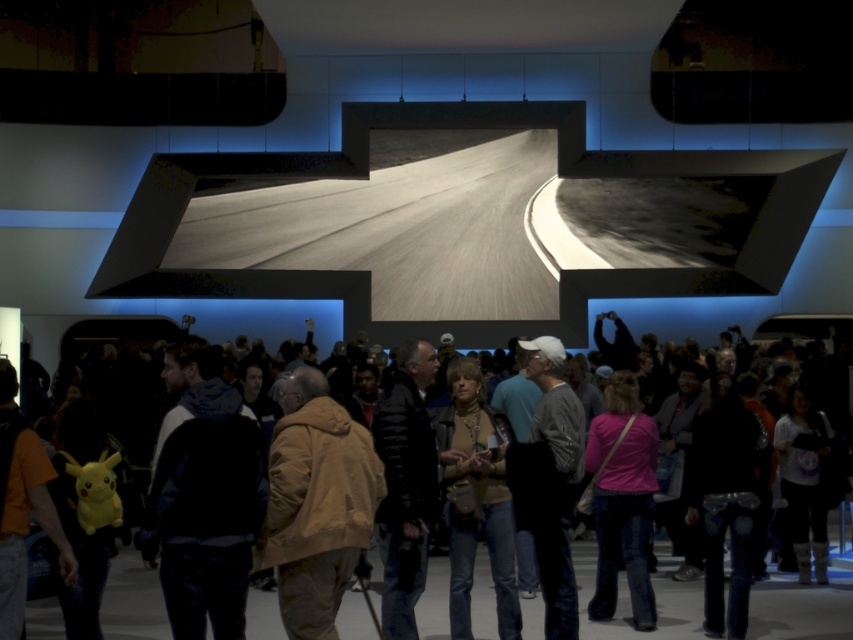
Question: Does dark blue hoodie at center appear on the left side of tan suede jacket at center?

Choices:
 (A) no
 (B) yes

Answer: (B)

Question: Which object is farther from the camera taking this photo?

Choices:
 (A) pink fabric shirt at center
 (B) black leather jacket at center
 (C) tan suede jacket at center

Answer: (A)

Question: Which of the following is the closest to the observer?

Choices:
 (A) tan suede jacket at center
 (B) brown leather jacket at center
 (C) black leather jacket at center
 (D) pink fabric shirt at center

Answer: (A)

Question: Does dark blue hoodie at center appear on the left side of tan suede jacket at center?

Choices:
 (A) no
 (B) yes

Answer: (B)

Question: Which point is farther to the camera?

Choices:
 (A) click(381, 509)
 (B) click(616, 483)
 (C) click(300, 536)
 (D) click(813, 614)

Answer: (B)

Question: Is tan suede jacket at center bigger than black leather jacket at center?

Choices:
 (A) no
 (B) yes

Answer: (B)